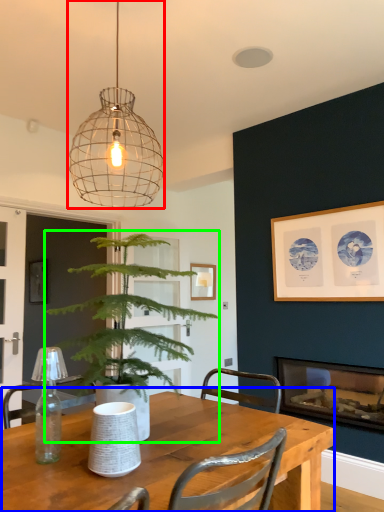
Question: Which is farther away from lamp (highlighted by a red box)? table (highlighted by a blue box) or houseplant (highlighted by a green box)?

Choices:
 (A) table
 (B) houseplant

Answer: (A)